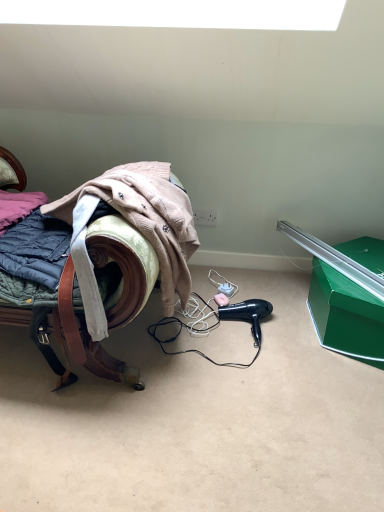
At what (x,y) coordinates should I click in order to perform the action: click on free point below black plastic hair dryer at lower center (from a real-world perspective). Please return your answer as a coordinate pair (x, y). This screenshot has height=512, width=384. Looking at the image, I should click on (259, 333).